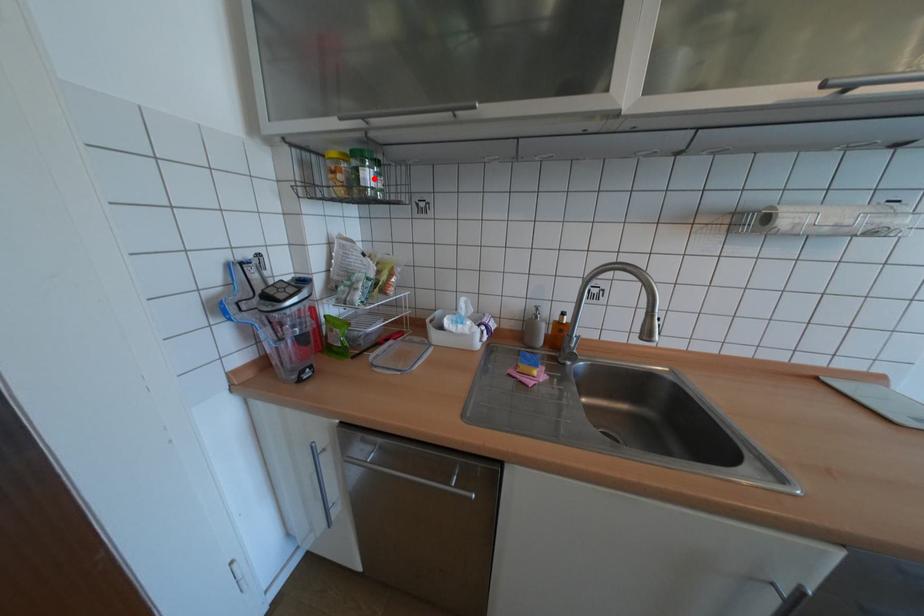
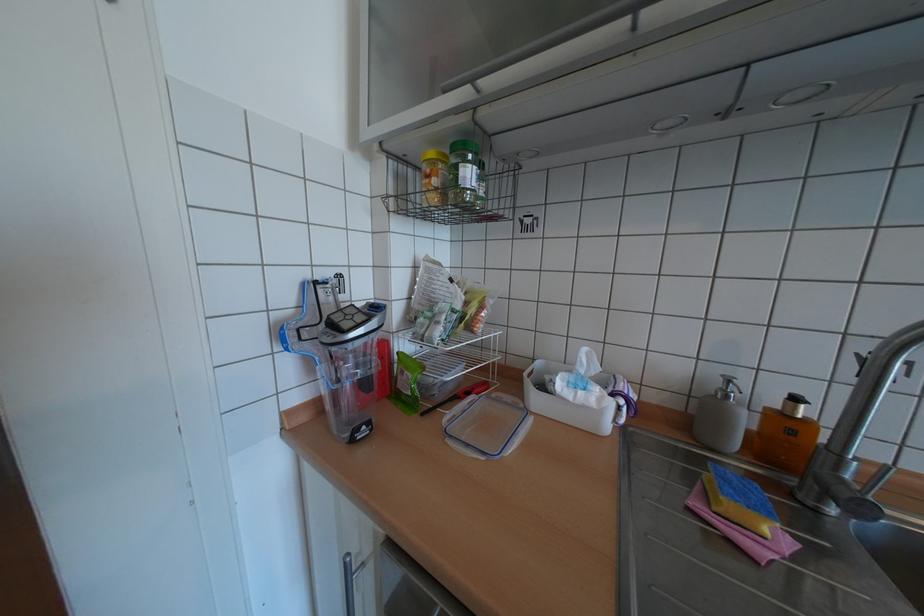
Locate, in the second image, the point that corresponds to the highlighted location in the first image.

(473, 177)